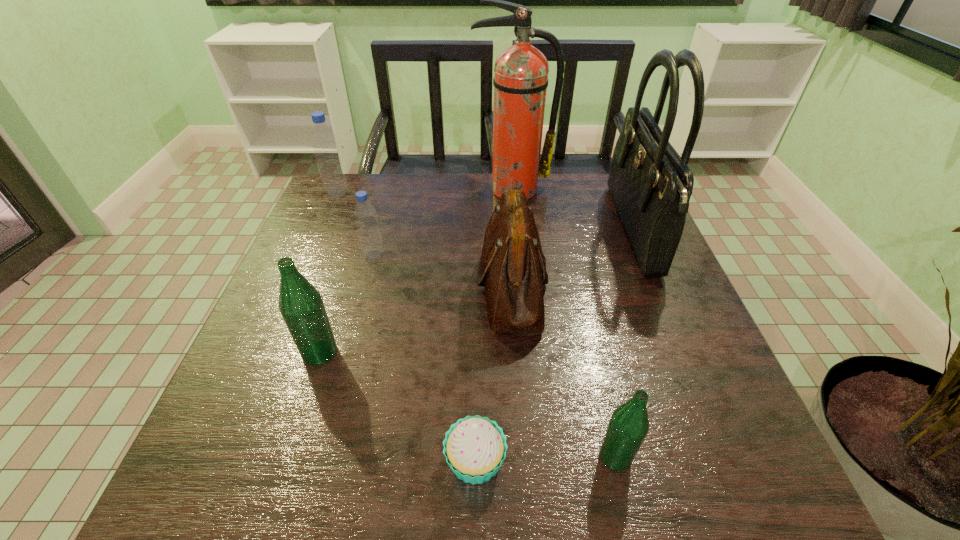
Find the location of a particular element. The height and width of the screenshot is (540, 960). vacant region located 0.220m on the back of the brown shoulder bag is located at coordinates (505, 195).

Identify the location of free space located on the left of the second farthest bottle. (324, 255).

This screenshot has height=540, width=960. Find the location of `vacant area located 0.240m on the left of the smaller green bottle`. vacant area located 0.240m on the left of the smaller green bottle is located at coordinates (453, 456).

You are a GUI agent. You are given a task and a screenshot of the screen. Output one action in this format:
    pyautogui.click(x=<x>, y=<y>)
    Task: Click on the free location located 0.310m on the back of the white cupcake
    The width and height of the screenshot is (960, 540).
    Given the screenshot: What is the action you would take?
    pyautogui.click(x=476, y=301)

What are the coordinates of `fire extinguisher positioned at the far edge` in the screenshot? It's located at (520, 81).

Locate an element on the screen. handbag that is at the far edge is located at coordinates (651, 185).

The height and width of the screenshot is (540, 960). Identify the location of bottle that is at the far edge. (324, 142).

Where is `bottle present at the near edge`? Image resolution: width=960 pixels, height=540 pixels. bottle present at the near edge is located at coordinates (629, 424).

Find the location of a particular element. cupcake present at the near edge is located at coordinates (474, 447).

Identify the location of object located at the right edge. The width and height of the screenshot is (960, 540). (651, 185).